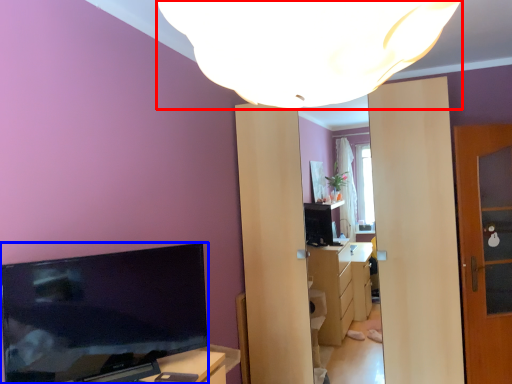
Question: Which point is further to the camera, lamp (highlighted by a red box) or television (highlighted by a blue box)?

Choices:
 (A) lamp
 (B) television

Answer: (B)